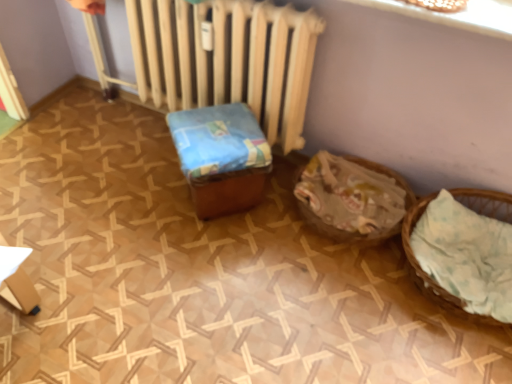
Question: Is brown woven basket at lower right, the second basket positioned from the right, bigger than light brown woven basket at right, arranged as the 1th basket when viewed from the right?

Choices:
 (A) yes
 (B) no

Answer: (B)

Question: Considering the relative positions of brown woven basket at lower right, arranged as the first basket when viewed from the left, and light brown woven basket at right, arranged as the 1th basket when viewed from the right, in the image provided, is brown woven basket at lower right, arranged as the first basket when viewed from the left, behind light brown woven basket at right, arranged as the 1th basket when viewed from the right,?

Choices:
 (A) no
 (B) yes

Answer: (B)

Question: Is brown woven basket at lower right, arranged as the first basket when viewed from the left, aimed at light brown woven basket at right, arranged as the 1th basket when viewed from the right?

Choices:
 (A) no
 (B) yes

Answer: (A)

Question: From a real-world perspective, is brown woven basket at lower right, the second basket positioned from the right, over light brown woven basket at right, arranged as the 1th basket when viewed from the right?

Choices:
 (A) yes
 (B) no

Answer: (B)

Question: Can you confirm if brown woven basket at lower right, the second basket positioned from the right, is positioned to the left of light brown woven basket at right, arranged as the 2th basket when viewed from the left?

Choices:
 (A) no
 (B) yes

Answer: (B)

Question: From the image's perspective, is brown woven basket at lower right, arranged as the first basket when viewed from the left, over light brown woven basket at right, arranged as the 1th basket when viewed from the right?

Choices:
 (A) no
 (B) yes

Answer: (B)

Question: From a real-world perspective, is light brown woven basket at right, arranged as the 2th basket when viewed from the left, below brown woven basket at lower right, the second basket positioned from the right?

Choices:
 (A) yes
 (B) no

Answer: (B)

Question: Is light brown woven basket at right, arranged as the 1th basket when viewed from the right, far from brown woven basket at lower right, the second basket positioned from the right?

Choices:
 (A) no
 (B) yes

Answer: (A)

Question: Is the position of light brown woven basket at right, arranged as the 1th basket when viewed from the right, less distant than that of brown woven basket at lower right, the second basket positioned from the right?

Choices:
 (A) no
 (B) yes

Answer: (B)

Question: Considering the relative positions of light brown woven basket at right, arranged as the 2th basket when viewed from the left, and brown woven basket at lower right, the second basket positioned from the right, in the image provided, is light brown woven basket at right, arranged as the 2th basket when viewed from the left, to the left of brown woven basket at lower right, the second basket positioned from the right, from the viewer's perspective?

Choices:
 (A) no
 (B) yes

Answer: (A)

Question: Does light brown woven basket at right, arranged as the 1th basket when viewed from the right, have a larger size compared to brown woven basket at lower right, the second basket positioned from the right?

Choices:
 (A) yes
 (B) no

Answer: (A)

Question: Considering the relative sizes of light brown woven basket at right, arranged as the 1th basket when viewed from the right, and brown woven basket at lower right, the second basket positioned from the right, in the image provided, is light brown woven basket at right, arranged as the 1th basket when viewed from the right, wider than brown woven basket at lower right, the second basket positioned from the right,?

Choices:
 (A) no
 (B) yes

Answer: (B)

Question: Does blue fabric-covered box at center have a larger size compared to white matte radiator at center?

Choices:
 (A) no
 (B) yes

Answer: (A)